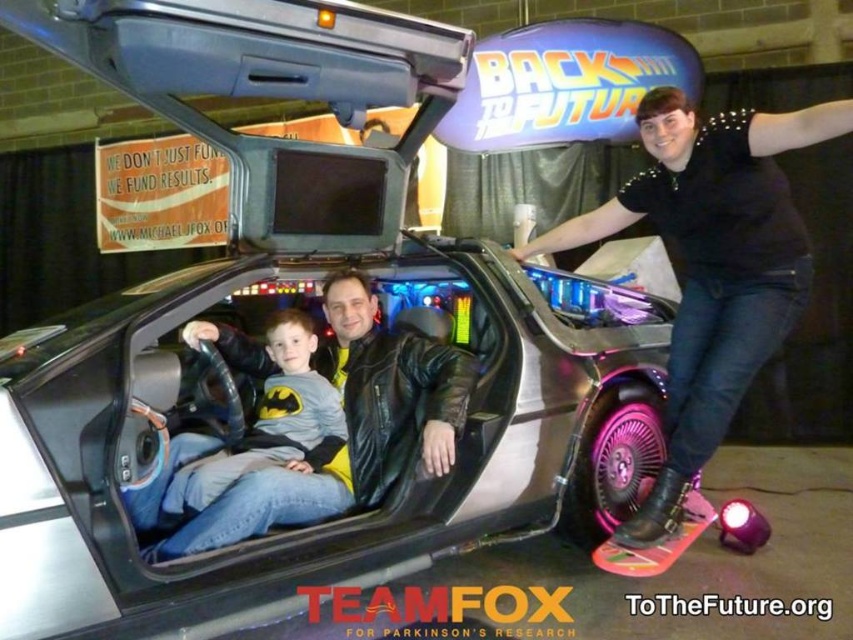
Question: Can you confirm if matte gray shirt at center is wider than leather jacket at center?

Choices:
 (A) no
 (B) yes

Answer: (A)

Question: Does matte gray shirt at center have a larger size compared to leather jacket at center?

Choices:
 (A) yes
 (B) no

Answer: (B)

Question: Which point is closer to the camera?

Choices:
 (A) (425, 356)
 (B) (276, 371)

Answer: (A)

Question: Does black leather jacket at upper right appear on the right side of leather jacket at center?

Choices:
 (A) yes
 (B) no

Answer: (A)

Question: Considering the real-world distances, which object is farthest from the leather jacket at center?

Choices:
 (A) black leather jacket at upper right
 (B) matte gray shirt at center

Answer: (A)

Question: Which object appears farthest from the camera in this image?

Choices:
 (A) black leather jacket at upper right
 (B) leather jacket at center

Answer: (B)